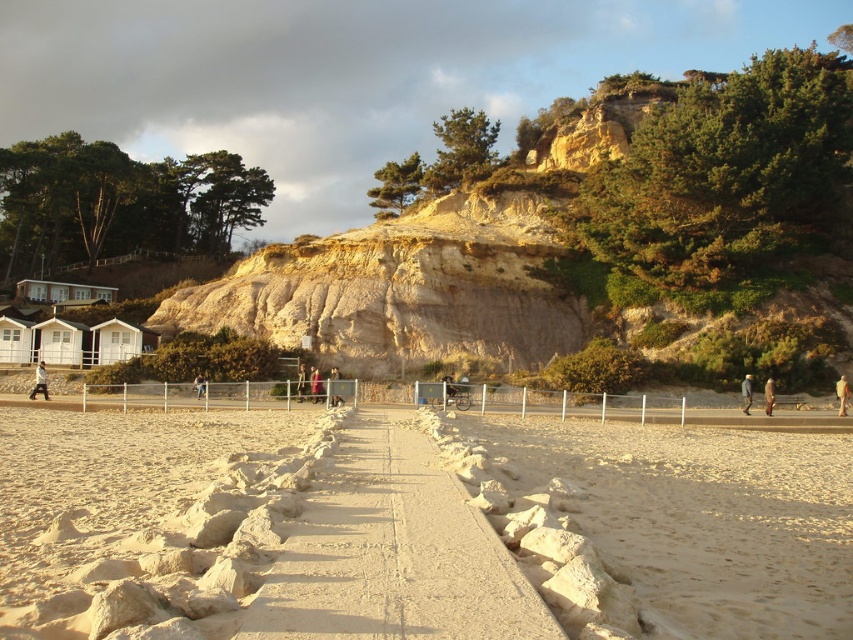
Question: Which of the following is the closest to the observer?

Choices:
 (A) (329, 397)
 (B) (363, 541)
 (C) (770, 449)
 (D) (305, 376)

Answer: (B)

Question: Considering the relative positions of sandy path at center and light brown leather jacket at center in the image provided, where is sandy path at center located with respect to light brown leather jacket at center?

Choices:
 (A) below
 (B) above

Answer: (A)

Question: Which object appears closest to the camera in this image?

Choices:
 (A) sandy concrete path at center
 (B) pink fabric dress at center
 (C) sandy path at center
 (D) dark gray jacket at left

Answer: (A)

Question: Can you confirm if beige sand at center is bigger than sandy concrete path at center?

Choices:
 (A) no
 (B) yes

Answer: (B)

Question: Estimate the real-world distances between objects in this image. Which object is closer to the beige sand at center?

Choices:
 (A) dark gray jacket at left
 (B) dark blue jacket at right

Answer: (B)

Question: In this image, where is dark blue jacket at right located relative to pink fabric dress at center?

Choices:
 (A) below
 (B) above

Answer: (A)